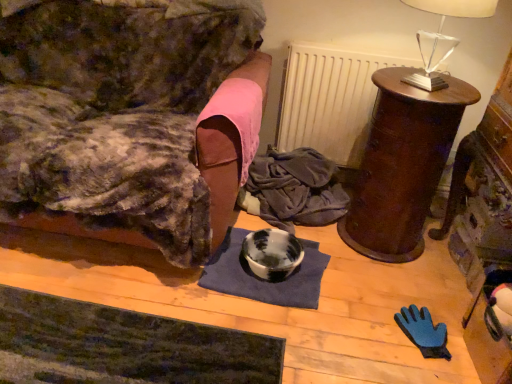
At what (x,y) coordinates should I click in order to perform the action: click on free space in front of dark blue fabric at center. Please return your answer as a coordinate pair (x, y). The image size is (512, 384). Looking at the image, I should click on (330, 244).